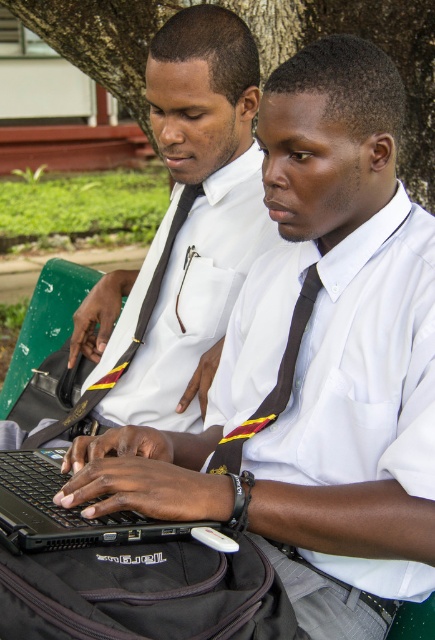
Which is behind, point (341, 4) or point (234, 445)?

Point (341, 4)

The width and height of the screenshot is (435, 640). What do you see at coordinates (378, 44) in the screenshot?
I see `green leafy tree at upper center` at bounding box center [378, 44].

This screenshot has height=640, width=435. In order to click on green leafy tree at upper center in this screenshot , I will do `click(378, 44)`.

Who is higher up, matte black laptop at center or black satin tie at center?

Positioned higher is matte black laptop at center.

Is point (244, 92) behind point (256, 426)?

Yes.

The height and width of the screenshot is (640, 435). What do you see at coordinates (180, 237) in the screenshot? I see `matte black laptop at center` at bounding box center [180, 237].

At what (x,y) coordinates should I click in order to perform the action: click on matte black laptop at center. Please return your answer as a coordinate pair (x, y). The width and height of the screenshot is (435, 640). Looking at the image, I should click on (180, 237).

Is point (254, 28) in front of point (137, 337)?

No, it is not.

Does green leafy tree at upper center have a lesser height compared to black satin tie at left?

In fact, green leafy tree at upper center may be taller than black satin tie at left.

The image size is (435, 640). What do you see at coordinates (378, 44) in the screenshot?
I see `green leafy tree at upper center` at bounding box center [378, 44].

Identify the location of green leafy tree at upper center. (378, 44).